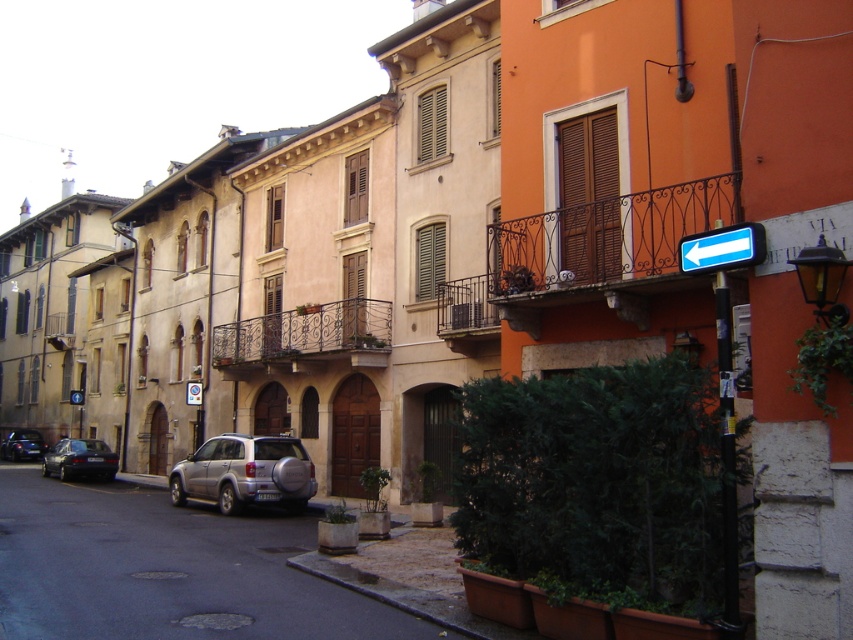
Question: Which object is closer to the camera taking this photo?

Choices:
 (A) shiny black sedan at lower left
 (B) rustic wrought iron balcony at center

Answer: (B)

Question: Which of the following is the farthest from the observer?

Choices:
 (A) shiny black sedan at lower left
 (B) dark gray metallic car at lower left
 (C) rustic wrought iron balcony at center

Answer: (A)

Question: Is satin silver suv at center positioned behind iron-forged balcony at center?

Choices:
 (A) yes
 (B) no

Answer: (B)

Question: Estimate the real-world distances between objects in this image. Which object is closer to the dark gray metallic car at lower left?

Choices:
 (A) rustic wrought iron balcony at center right
 (B) iron-forged balcony at center

Answer: (B)

Question: Is metallic silver suv at center behind rustic wrought iron balcony at center?

Choices:
 (A) yes
 (B) no

Answer: (B)

Question: Does satin silver suv at center have a lesser width compared to iron-forged balcony at center?

Choices:
 (A) yes
 (B) no

Answer: (B)